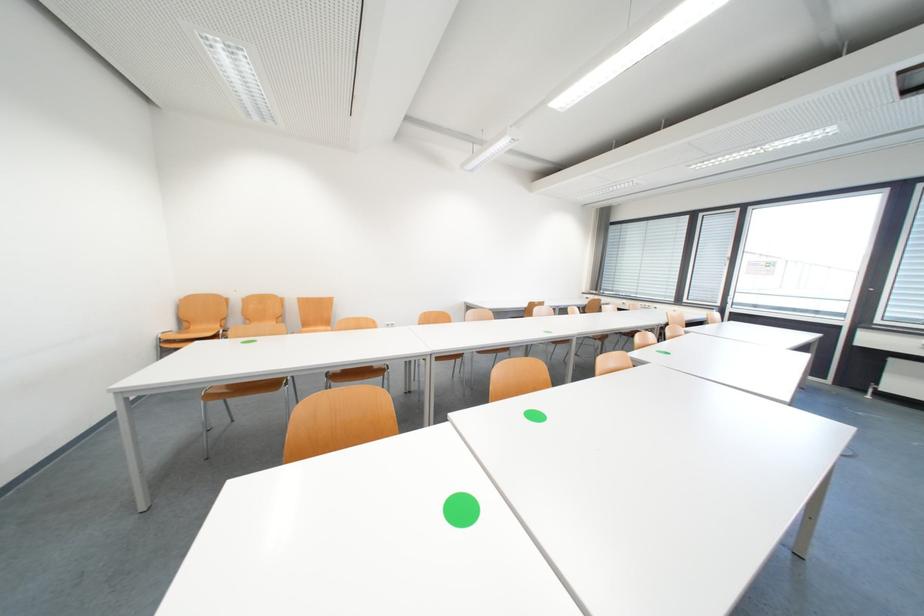
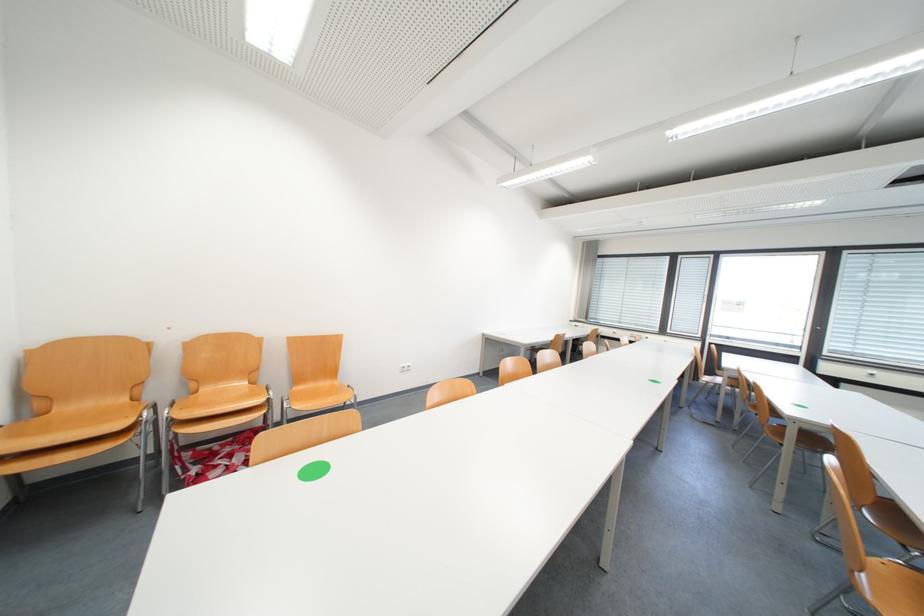
The images are taken continuously from a first-person perspective. In which direction are you moving?

The movement direction of the cameraman is left, forward.